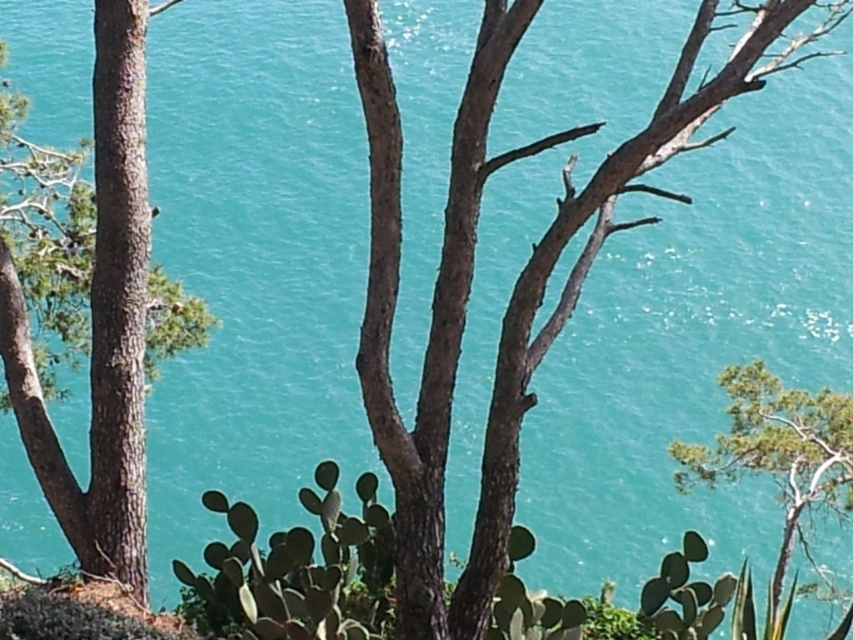
Which of these two, brown rough bark tree at left or green leafy tree at right, stands taller?

brown rough bark tree at left

Is brown rough bark tree at left shorter than green leafy tree at right?

In fact, brown rough bark tree at left may be taller than green leafy tree at right.

Who is more distant from viewer, [126,397] or [676,476]?

Positioned behind is point [676,476].

This screenshot has height=640, width=853. Find the location of `brown rough bark tree at left`. brown rough bark tree at left is located at coordinates (99, 321).